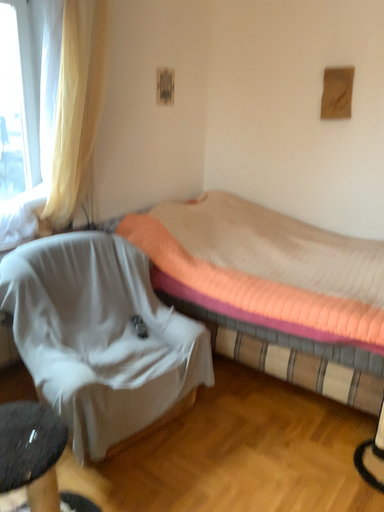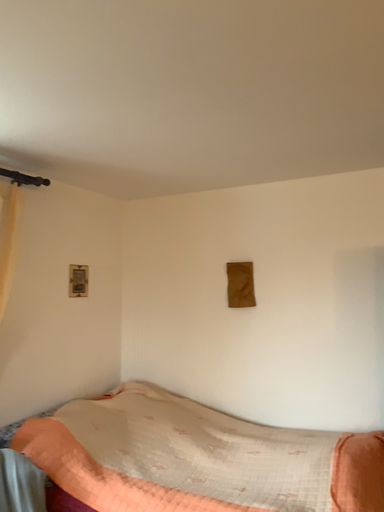
Question: How did the camera likely rotate when shooting the video?

Choices:
 (A) rotated right
 (B) rotated left

Answer: (A)